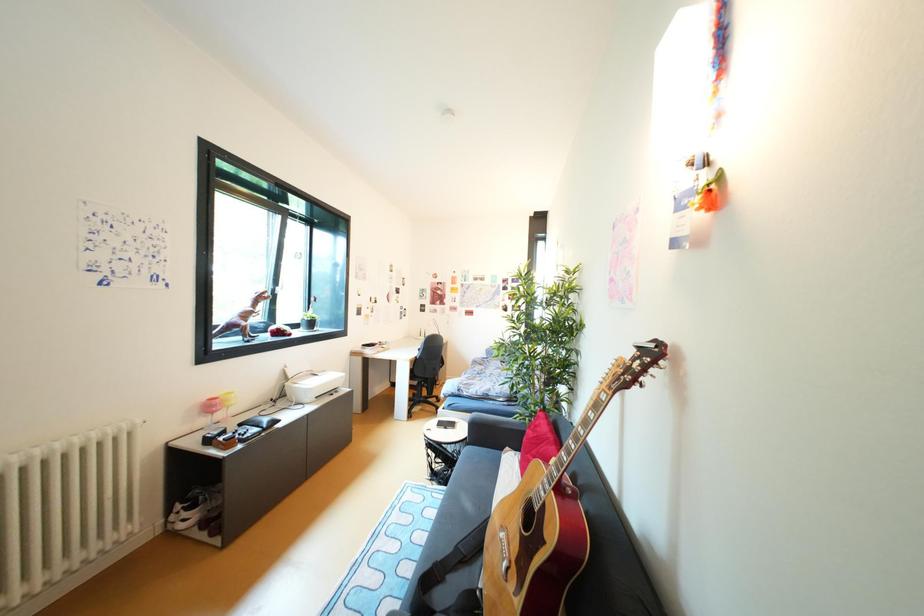
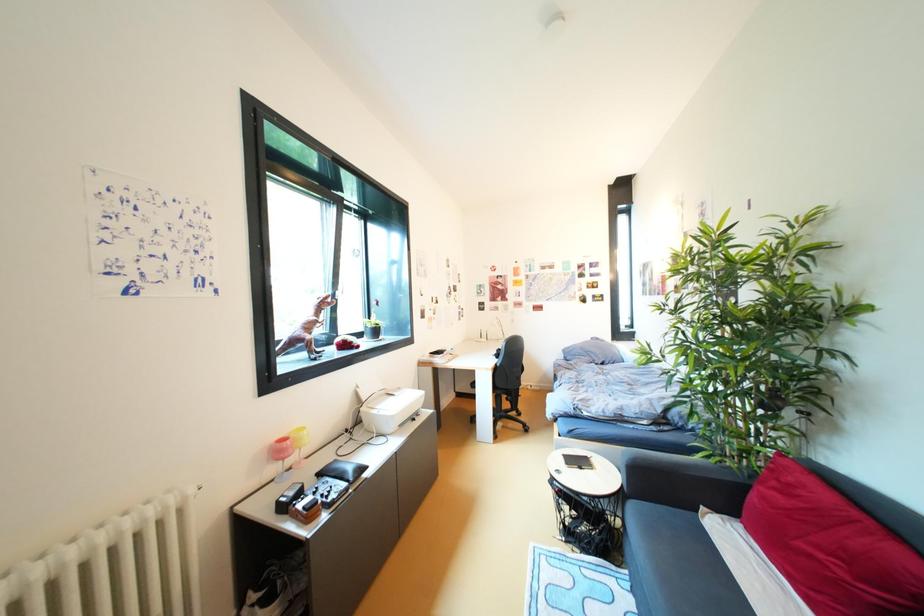
In a continuous first-person perspective shot, in which direction is the camera moving?

The cameraman walked toward left, forward.